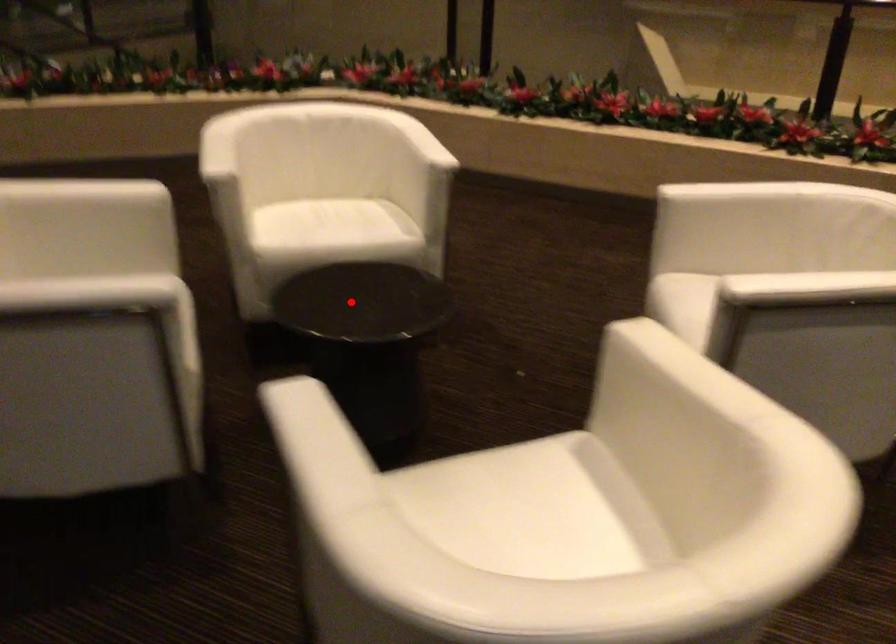
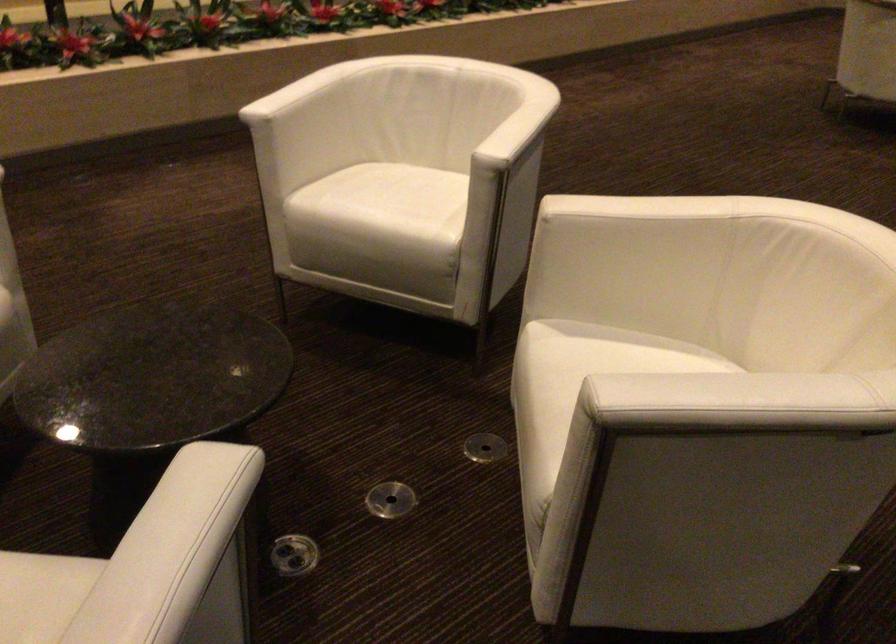
In the second image, find the point that corresponds to the highlighted location in the first image.

(152, 377)